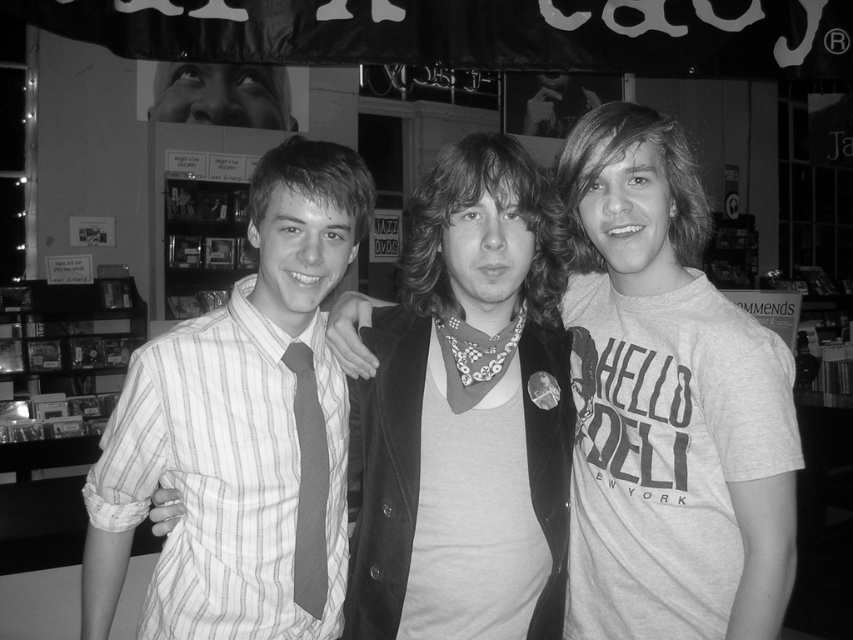
Question: Estimate the real-world distances between objects in this image. Which object is farther from the striped fabric tie at center?

Choices:
 (A) striped cotton shirt at center
 (B) matte black jacket at center

Answer: (B)

Question: Is striped cotton shirt at center thinner than striped fabric tie at center?

Choices:
 (A) yes
 (B) no

Answer: (B)

Question: Which of the following is the farthest from the observer?

Choices:
 (A) (595, 497)
 (B) (141, 476)
 (C) (312, 448)

Answer: (A)

Question: Does matte black jacket at center appear over striped cotton shirt at center?

Choices:
 (A) no
 (B) yes

Answer: (B)

Question: Which of the following is the farthest from the observer?

Choices:
 (A) (321, 547)
 (B) (618, 625)

Answer: (B)

Question: Is the position of matte black jacket at center less distant than that of striped fabric tie at center?

Choices:
 (A) no
 (B) yes

Answer: (B)